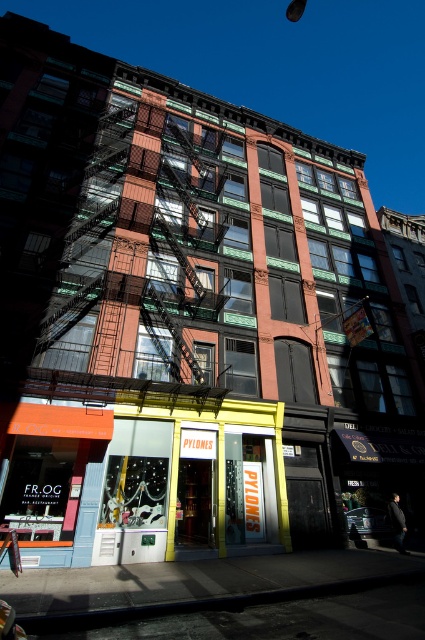
Between yellow painted storefront at center and orange matte signboard at lower left, which one appears on the right side from the viewer's perspective?

yellow painted storefront at center is more to the right.

From the picture: Does yellow painted storefront at center have a larger size compared to orange matte signboard at lower left?

No.

Locate an element on the screen. yellow painted storefront at center is located at coordinates (141, 470).

Does rustic metal fire escape at center have a greater width compared to orange matte signboard at lower left?

Yes.

Is point (207, 141) behind point (110, 424)?

Yes, it is.

Where is `rustic metal fire escape at center`? rustic metal fire escape at center is located at coordinates (147, 257).

Does yellow painted storefront at center have a smaller size compared to rustic metal fire escape at center?

Correct, yellow painted storefront at center occupies less space than rustic metal fire escape at center.

Which is behind, point (76, 483) or point (170, 177)?

Positioned behind is point (170, 177).

Where is `yellow painted storefront at center`? yellow painted storefront at center is located at coordinates pyautogui.click(x=141, y=470).

Find the location of a particular element. yellow painted storefront at center is located at coordinates (141, 470).